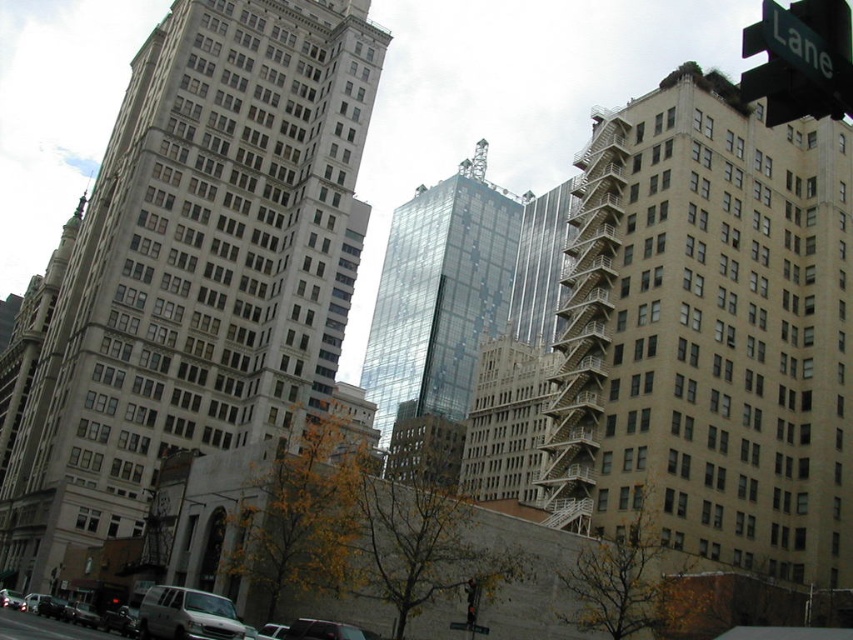
Question: Among these objects, which one is farthest from the camera?

Choices:
 (A) transparent glass building at center
 (B) matte white van at lower left

Answer: (A)

Question: Which of the following is the farthest from the observer?

Choices:
 (A) (700, 296)
 (B) (502, 234)

Answer: (B)

Question: Observing the image, what is the correct spatial positioning of white matte van at lower left in reference to metallic traffic light at center?

Choices:
 (A) right
 (B) left

Answer: (B)

Question: Is beige concrete fire escape at right closer to the viewer compared to green plastic street sign at upper right?

Choices:
 (A) no
 (B) yes

Answer: (A)

Question: Does silver metallic van at lower left appear on the right side of metallic traffic light at center?

Choices:
 (A) no
 (B) yes

Answer: (A)

Question: Which point is farther to the camera?

Choices:
 (A) green plastic street sign at upper right
 (B) white matte van at lower left

Answer: (A)